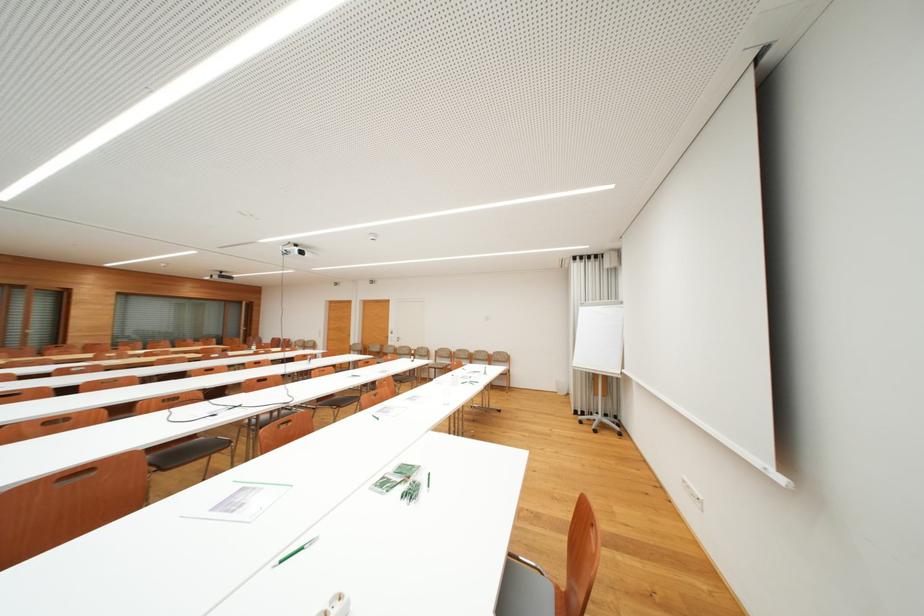
Where is `projector screen handle`? projector screen handle is located at coordinates (777, 477).